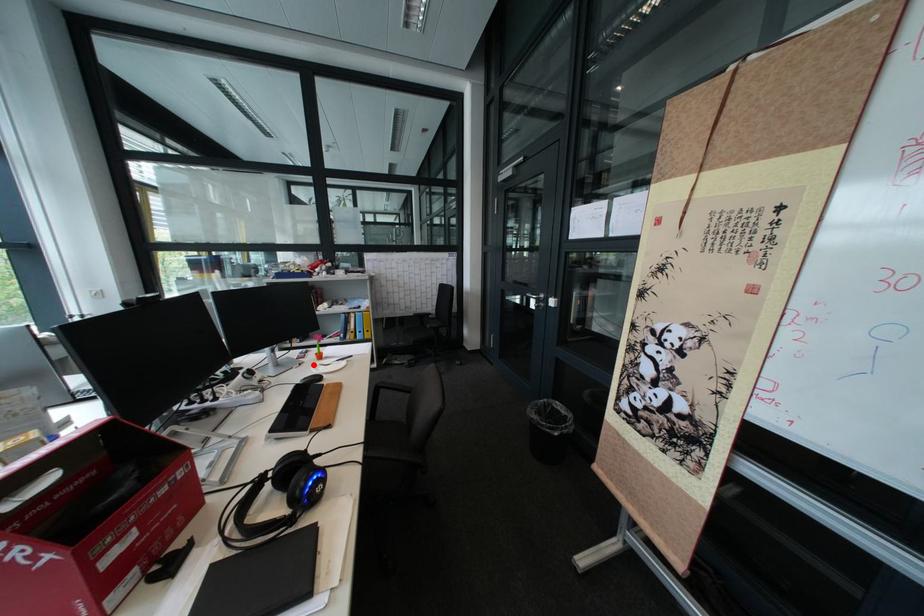
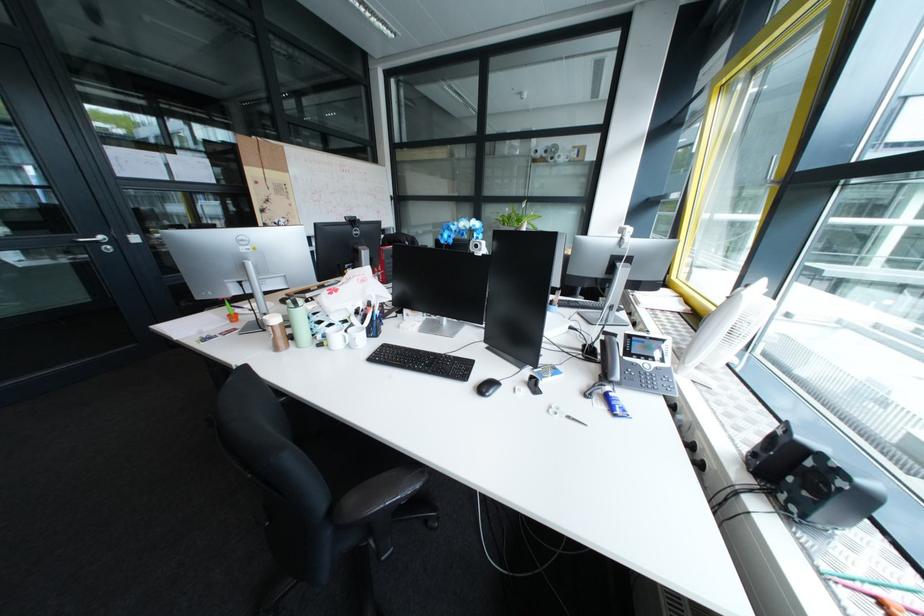
Question: I am providing you with two images of the same scene from different viewpoints. A red point is marked on the first image. Is the red point's position out of view in image 2?

Choices:
 (A) Yes
 (B) No

Answer: (A)